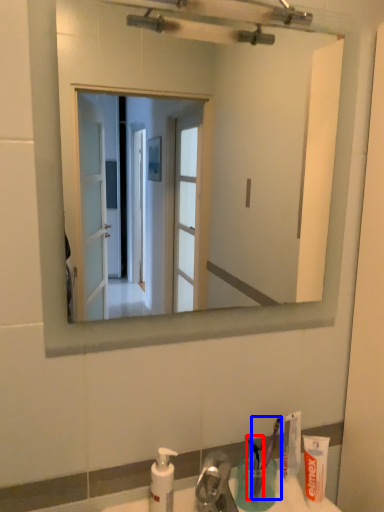
Question: Among these objects, which one is nearest to the camera, toothbrush (highlighted by a red box) or toothbrush (highlighted by a blue box)?

Choices:
 (A) toothbrush
 (B) toothbrush

Answer: (A)